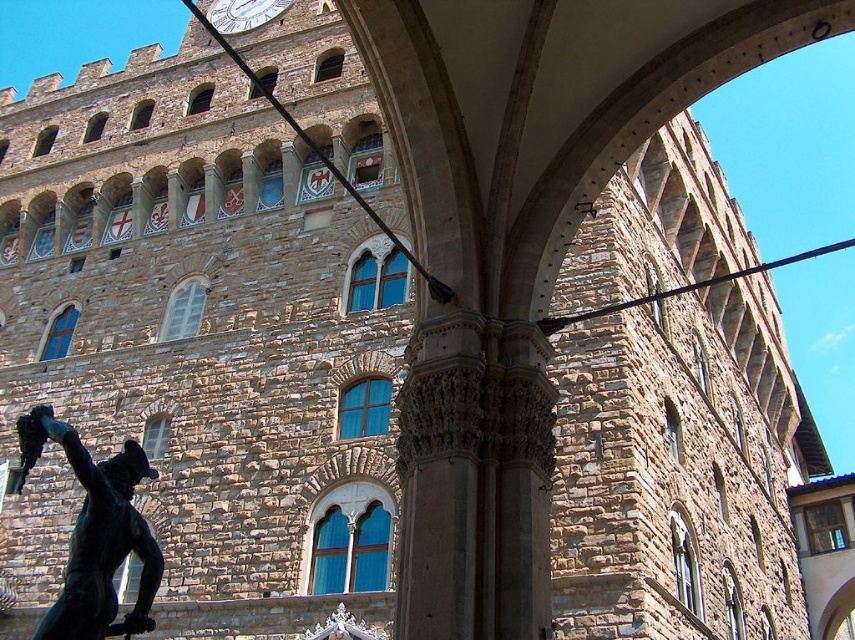
Does green patina bronze statue at lower left come behind white glossy clock at upper center?

No, green patina bronze statue at lower left is in front of white glossy clock at upper center.

The width and height of the screenshot is (855, 640). What are the coordinates of `green patina bronze statue at lower left` in the screenshot? It's located at (96, 534).